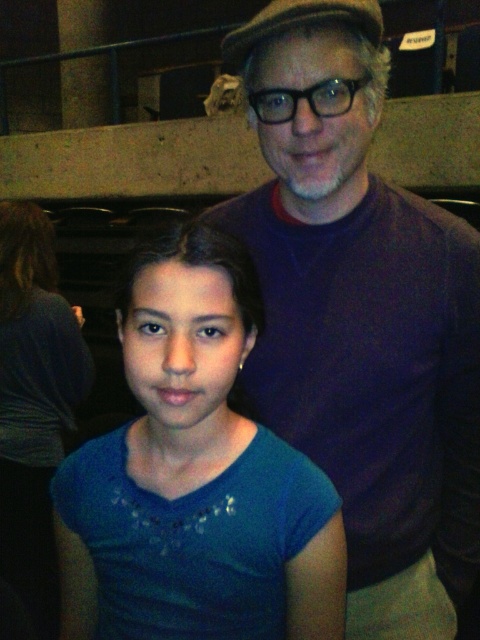
Question: Can you confirm if purple sweater at upper right is wider than blue cotton shirt at lower left?

Choices:
 (A) yes
 (B) no

Answer: (A)

Question: Which of the following is the closest to the observer?

Choices:
 (A) (26, 218)
 (B) (383, 397)
 (C) (93, 556)

Answer: (C)

Question: Which point is farther to the camera?

Choices:
 (A) (10, 294)
 (B) (95, 568)
 (C) (469, 387)

Answer: (A)

Question: Does blue fabric shirt at center lie behind blue cotton shirt at lower left?

Choices:
 (A) no
 (B) yes

Answer: (A)

Question: Among these objects, which one is farthest from the camera?

Choices:
 (A) blue cotton shirt at lower left
 (B) blue fabric shirt at center
 (C) purple sweater at upper right

Answer: (A)

Question: Is purple sweater at upper right above blue fabric shirt at center?

Choices:
 (A) yes
 (B) no

Answer: (A)